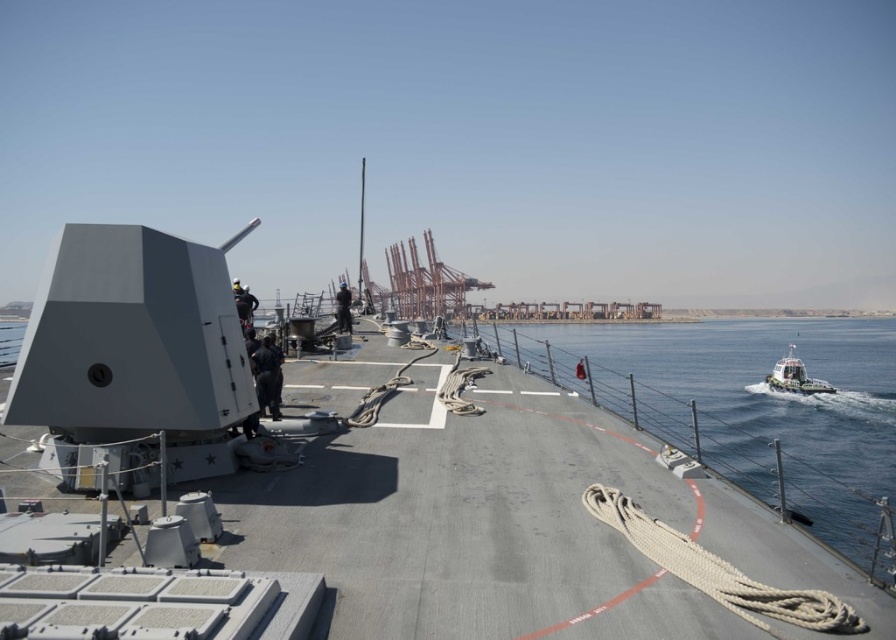
You are a crew member on the naval ship deck. You need to locate the metallic figure at center quickly. From your current position at the dark blue uniform at center, which direction should you move to find it?

The dark blue uniform at center is in front of the metallic figure at center, so you should move backward to reach the metallic figure at center.

You are a sailor on the deck of the naval ship. You need to reach a point that is 128.50 feet away from your current position. The point is marked as point (x=759, y=400). Can you confirm if this point is within the visible deck area?

The point (x=759, y=400) is 128.50 feet from the viewer, so it is within the visible deck area as described.